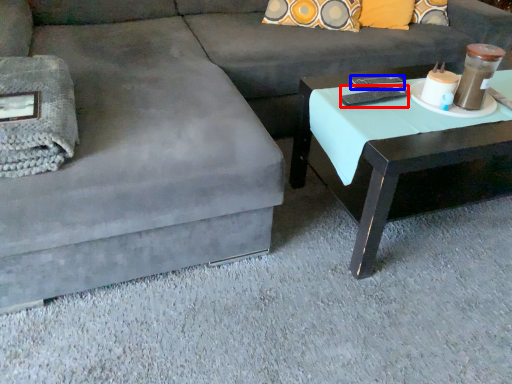
Question: Which object is further to the camera taking this photo, remote (highlighted by a red box) or remote (highlighted by a blue box)?

Choices:
 (A) remote
 (B) remote

Answer: (B)